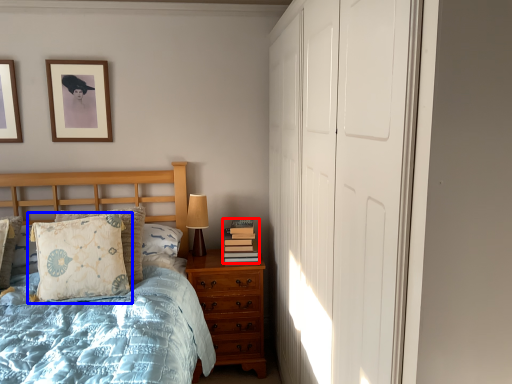
Question: Which object is closer to the camera taking this photo, book (highlighted by a red box) or pillow (highlighted by a blue box)?

Choices:
 (A) book
 (B) pillow

Answer: (B)